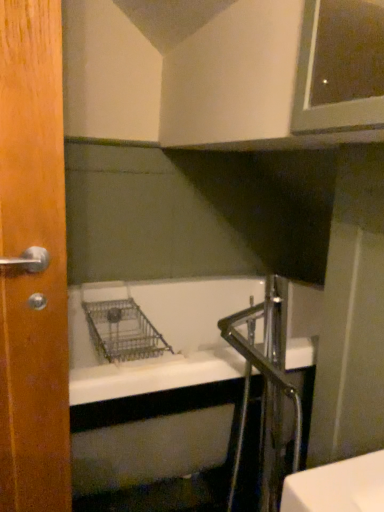
Question: Is metallic silver faucet at lower right taller or shorter than wooden door at left?

Choices:
 (A) short
 (B) tall

Answer: (A)

Question: Is metallic silver faucet at lower right wider or thinner than wooden door at left?

Choices:
 (A) thin
 (B) wide

Answer: (B)

Question: Considering the positions of point (243, 355) and point (16, 286), is point (243, 355) closer or farther from the camera than point (16, 286)?

Choices:
 (A) closer
 (B) farther

Answer: (B)

Question: Is wooden door at left inside the boundaries of metallic silver faucet at lower right, or outside?

Choices:
 (A) outside
 (B) inside

Answer: (A)

Question: In terms of size, does wooden door at left appear bigger or smaller than metallic silver faucet at lower right?

Choices:
 (A) small
 (B) big

Answer: (A)

Question: From the image's perspective, is wooden door at left located above or below metallic silver faucet at lower right?

Choices:
 (A) above
 (B) below

Answer: (A)

Question: Considering the positions of wooden door at left and metallic silver faucet at lower right in the image, is wooden door at left taller or shorter than metallic silver faucet at lower right?

Choices:
 (A) short
 (B) tall

Answer: (B)